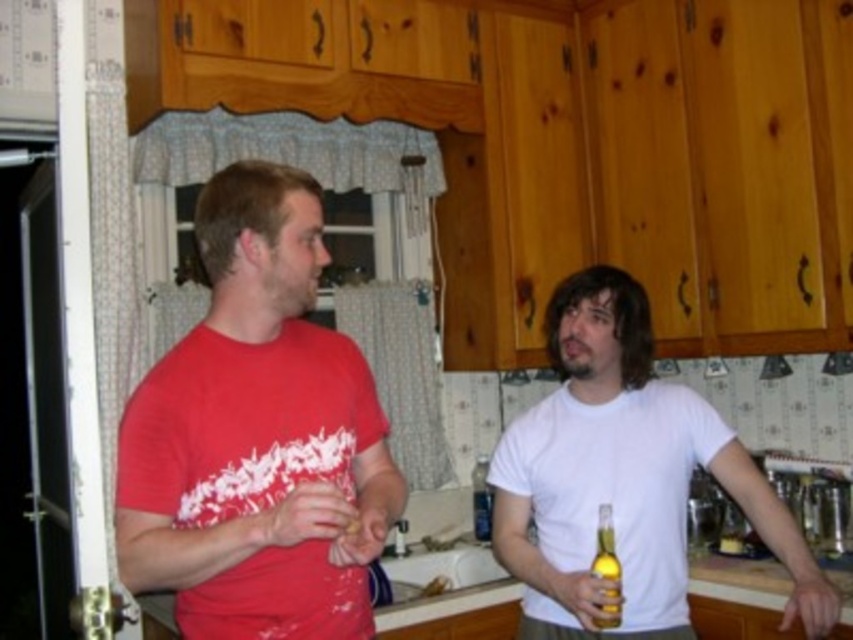
Question: Which object appears closest to the camera in this image?

Choices:
 (A) matte red t-shirt at left
 (B) yellow glass bottle at lower right
 (C) translucent glass bottle at center

Answer: (A)

Question: Is matte red t-shirt at left to the left of translucent glass bottle at center from the viewer's perspective?

Choices:
 (A) yes
 (B) no

Answer: (A)

Question: Is white matte shirt at center bigger than translucent glass bottle at center?

Choices:
 (A) yes
 (B) no

Answer: (A)

Question: Which point is closer to the camera?

Choices:
 (A) (610, 529)
 (B) (476, 531)
 (C) (512, 566)

Answer: (A)

Question: Which point is farther to the camera?

Choices:
 (A) (485, 456)
 (B) (155, 392)
 (C) (640, 492)

Answer: (A)

Question: Does matte red t-shirt at left have a smaller size compared to translucent glass bottle at center?

Choices:
 (A) no
 (B) yes

Answer: (A)